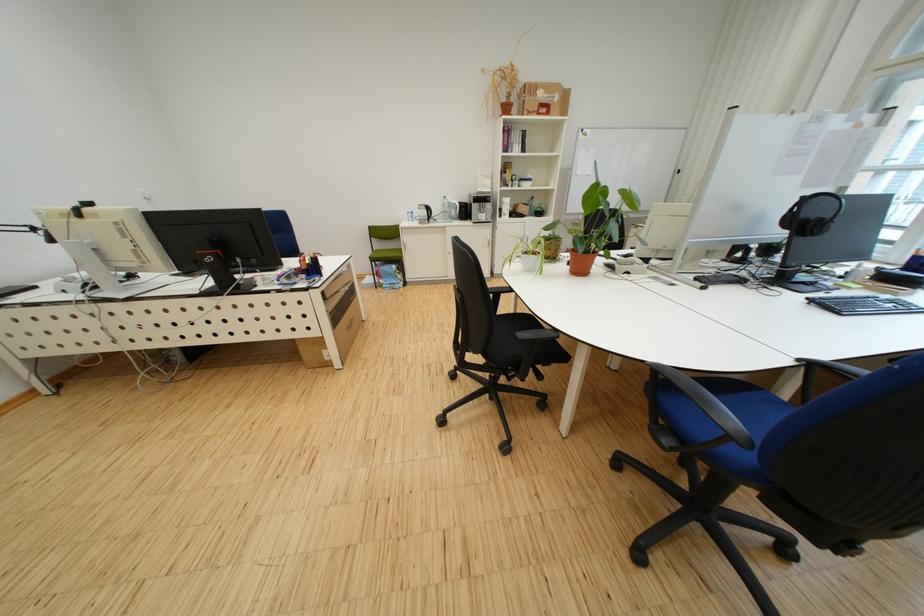
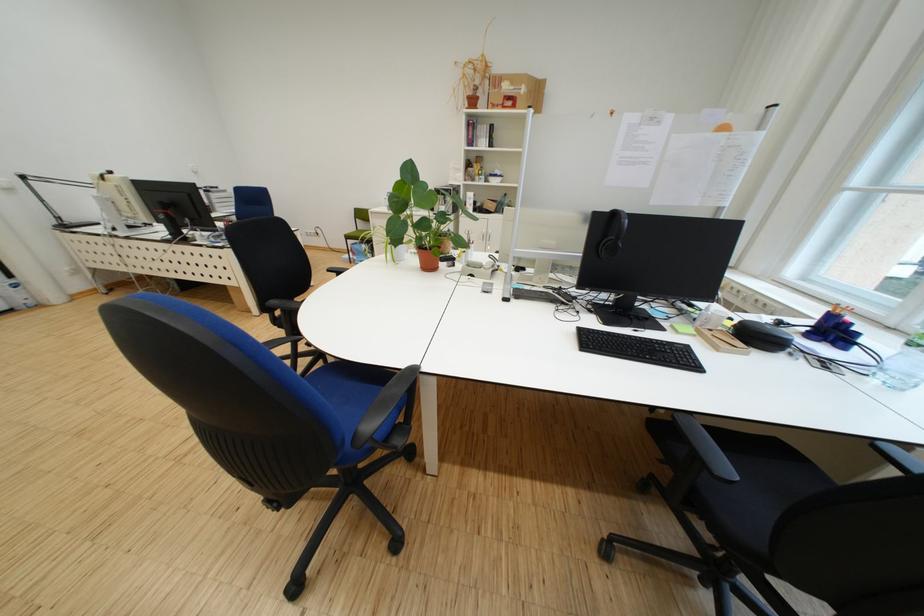
Question: What movement of the cameraman would produce the second image?

Choices:
 (A) Left
 (B) Right
 (C) Forward
 (D) Backward

Answer: (B)